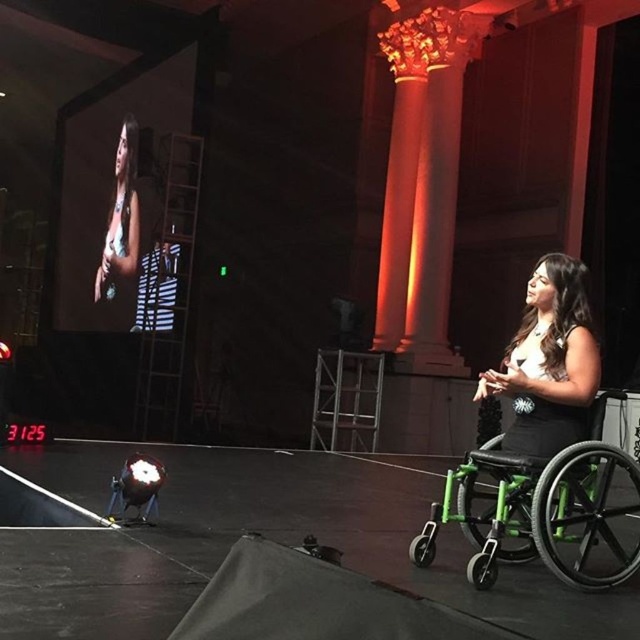
Can you confirm if metallic green wheelchair at lower right is positioned below black matte wheelchair at lower right?

Correct, metallic green wheelchair at lower right is located below black matte wheelchair at lower right.

Can you confirm if metallic green wheelchair at lower right is wider than black matte wheelchair at lower right?

Yes, metallic green wheelchair at lower right is wider than black matte wheelchair at lower right.

Between point (637, 605) and point (506, 364), which one is positioned behind?

The point (506, 364) is behind.

You are a GUI agent. You are given a task and a screenshot of the screen. Output one action in this format:
    pyautogui.click(x=<x>, y=<y>)
    Task: Click on the metallic green wheelchair at lower right
    The image size is (640, 640).
    Given the screenshot: What is the action you would take?
    pyautogui.click(x=264, y=536)

Which is behind, point (77, 476) or point (138, 228)?

Point (138, 228)

What do you see at coordinates (264, 536) in the screenshot? I see `metallic green wheelchair at lower right` at bounding box center [264, 536].

The height and width of the screenshot is (640, 640). Find the location of `metallic green wheelchair at lower right`. metallic green wheelchair at lower right is located at coordinates (264, 536).

Which is above, green plastic wheelchair at right or black matte wheelchair at lower right?

Positioned higher is black matte wheelchair at lower right.

Can you confirm if green plastic wheelchair at right is shorter than black matte wheelchair at lower right?

In fact, green plastic wheelchair at right may be taller than black matte wheelchair at lower right.

Does point (550, 522) lie behind point (570, 275)?

No, it is not.

Where is `green plastic wheelchair at right`? The image size is (640, 640). green plastic wheelchair at right is located at coordinates (538, 508).